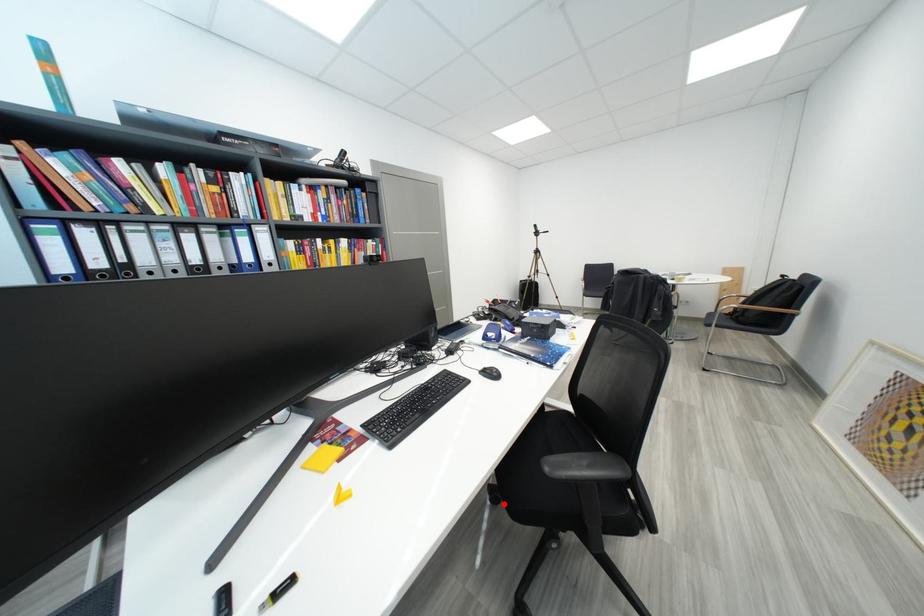
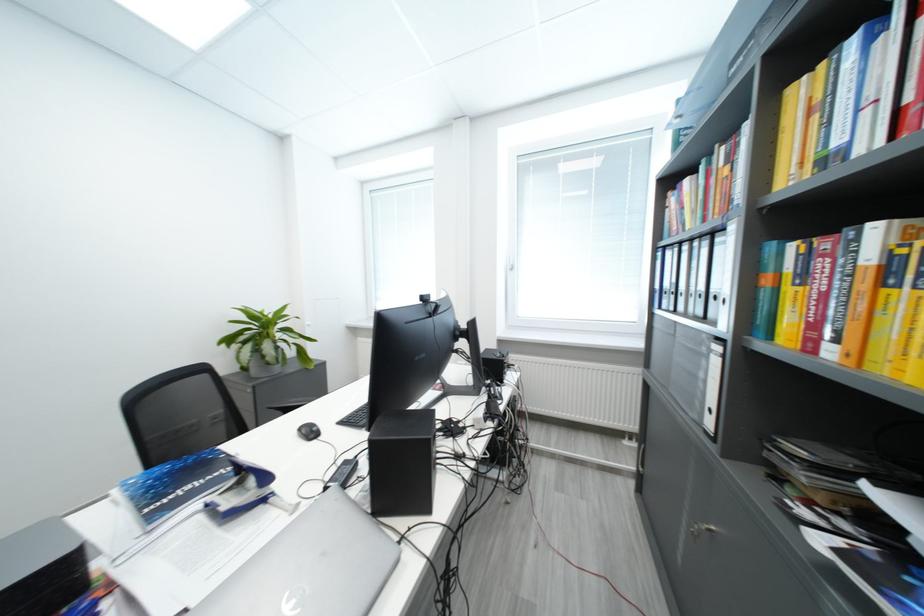
Question: I am providing you with two images of the same scene from different viewpoints. A red point is marked on the first image. Can you still see the location of the red point in image 2?

Choices:
 (A) Yes
 (B) No

Answer: (B)